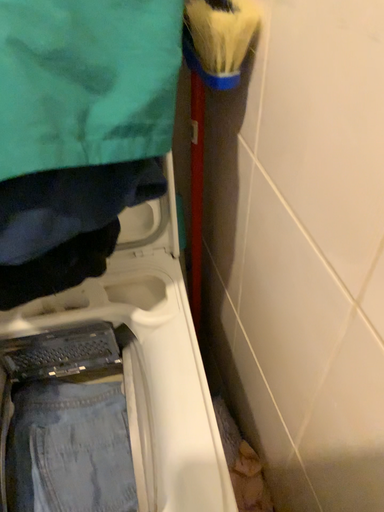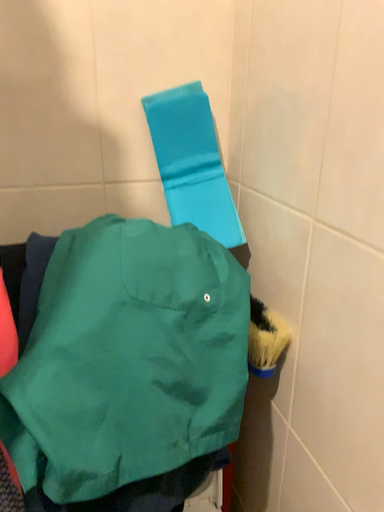
Question: How did the camera likely rotate when shooting the video?

Choices:
 (A) rotated upward
 (B) rotated downward

Answer: (A)